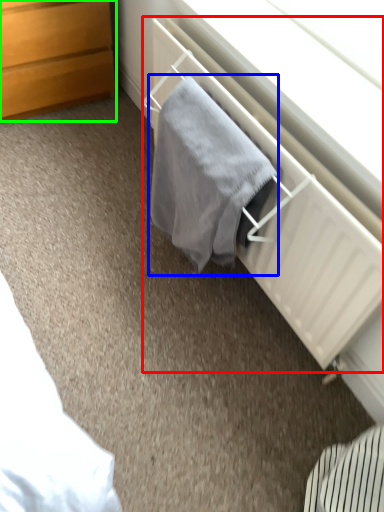
Question: Estimate the real-world distances between objects in this image. Which object is farther from radiator (highlighted by a red box), bath towel (highlighted by a blue box) or chest of drawers (highlighted by a green box)?

Choices:
 (A) bath towel
 (B) chest of drawers

Answer: (B)